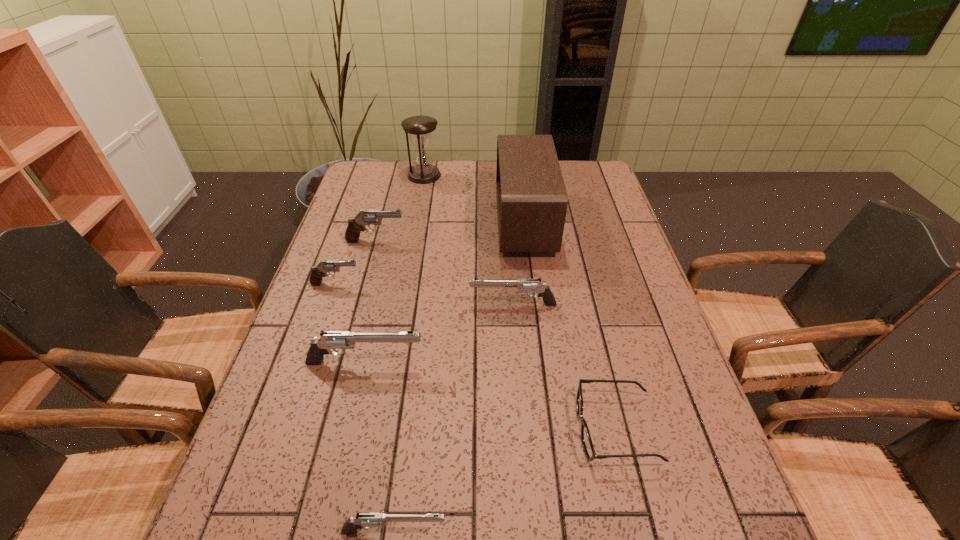
You are a GUI agent. You are given a task and a screenshot of the screen. Output one action in this format:
    pyautogui.click(x=<x>, y=<y>)
    Task: Click on the brown radio receiver
    This screenshot has width=960, height=540.
    Given the screenshot: What is the action you would take?
    pyautogui.click(x=532, y=200)

At what (x,y) coordinates should I click in order to perform the action: click on the farthest object. Please return your answer as a coordinate pair (x, y). Looking at the image, I should click on (419, 128).

The width and height of the screenshot is (960, 540). Identify the location of the farther gray pistol. (356, 224).

Identify the location of the bigger gray pistol. This screenshot has height=540, width=960. (356, 224).

The image size is (960, 540). In order to click on the biggest silver pistol in this screenshot , I will do point(343,340).

Identify the location of the fourth farthest pistol. (343, 340).

This screenshot has width=960, height=540. Find the location of `the fourth nearest object`. the fourth nearest object is located at coordinates (523, 285).

At what (x,y) coordinates should I click in order to perform the action: click on the farthest silver pistol. Please return your answer as a coordinate pair (x, y). Looking at the image, I should click on (523, 285).

I want to click on the fourth nearest pistol, so click(x=318, y=271).

Identify the location of the fourth farthest object. (318, 271).